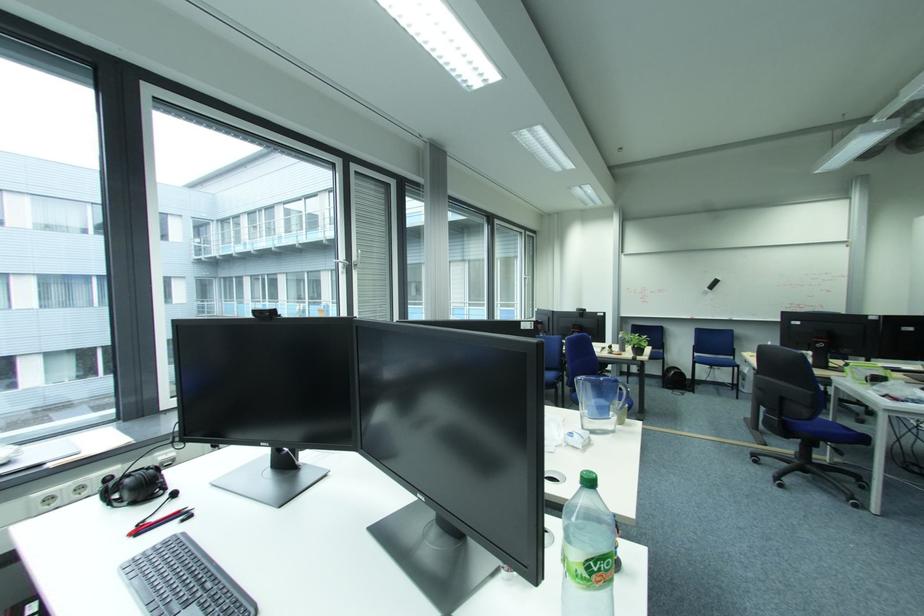
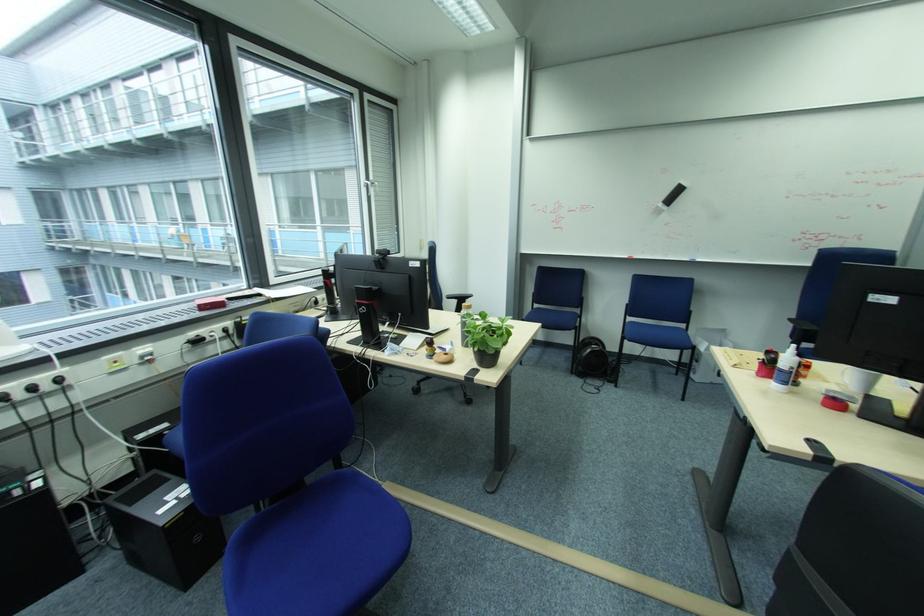
Question: I am providing you with two images of the same scene from different viewpoints. After the viewpoint changes to image2, which objects are now occluded?

Choices:
 (A) white ceramic mug
 (B) black whiteboard eraser
 (C) white window handle
 (D) none of these

Answer: (D)